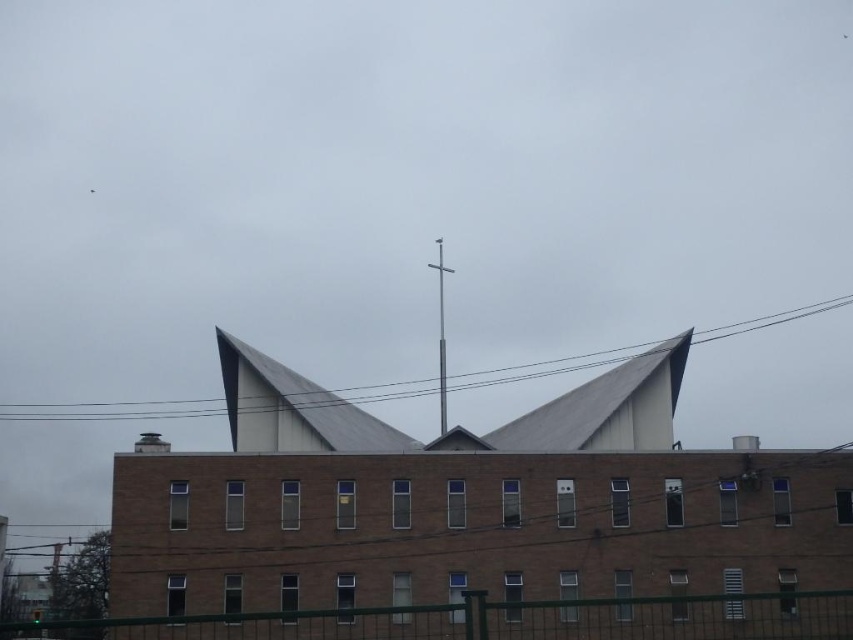
Question: Is black wire at upper center smaller than silver metallic cross at center?

Choices:
 (A) no
 (B) yes

Answer: (A)

Question: Which point is farther to the camera?

Choices:
 (A) black wire at upper center
 (B) silver metallic cross at center

Answer: (A)

Question: Does black wire at upper center have a greater width compared to silver metallic cross at center?

Choices:
 (A) no
 (B) yes

Answer: (B)

Question: From the image, what is the correct spatial relationship of black wire at upper center in relation to silver metallic cross at center?

Choices:
 (A) left
 (B) right

Answer: (A)